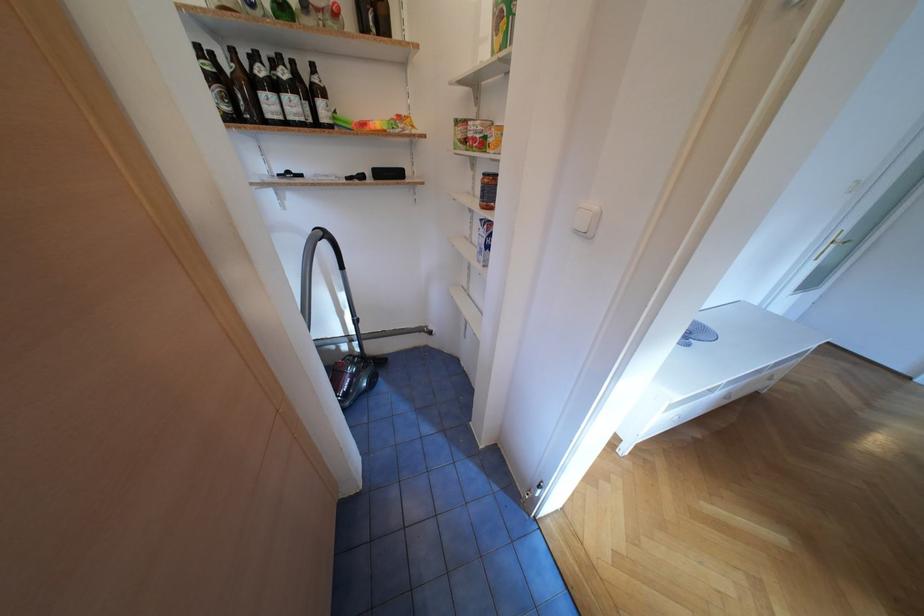
The width and height of the screenshot is (924, 616). I want to click on glass bowl, so click(x=698, y=334).